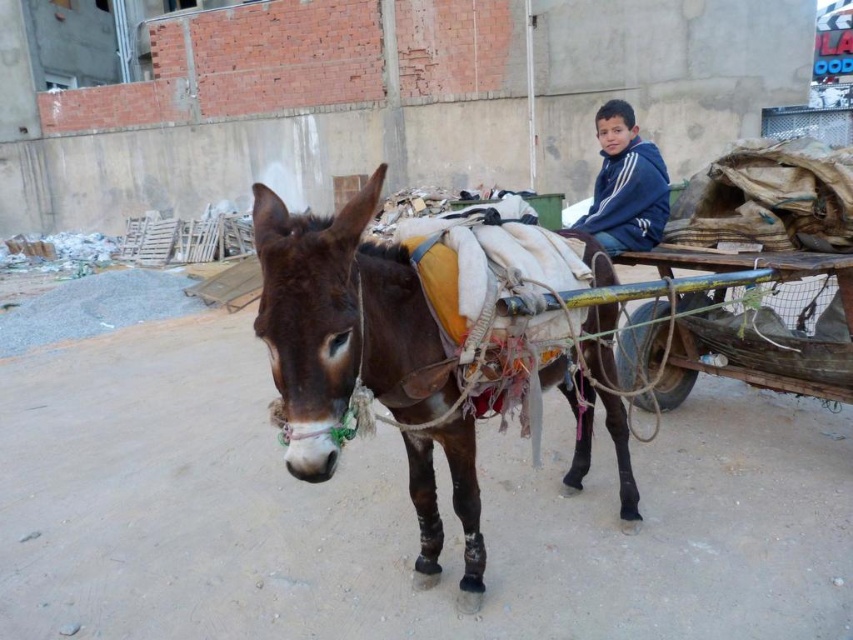
You are a photographer standing behind the camera. You want to take a photo of the brown leather donkey at center and the blue fleece jacket at upper center. Can you see both subjects clearly in the frame at the same time?

Yes, the brown leather donkey at center is in front of the blue fleece jacket at upper center, so both can be seen clearly in the frame together.

You are a delivery person who needs to secure a package on the wooden cart at center. The package must be placed above the blue fleece jacket at upper center to avoid rain. Can you place the package in the correct position?

The wooden cart at center is positioned under blue fleece jacket at upper center, so placing the package above the blue fleece jacket at upper center would mean placing it above the cart. However, the cart is already under the jacket, so the package cannot be placed both above the jacket and on the cart simultaneously. This might not be possible as described.